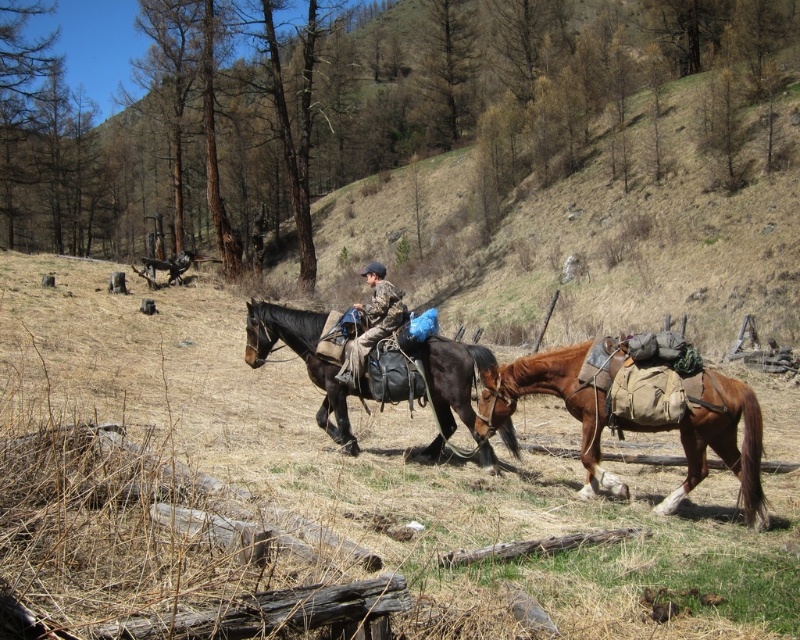
You are a traveler planning to ride the brown leather horse at right and carry the brown leather saddle at center. Given their sizes, will the saddle fit comfortably on the horse?

The brown leather horse at right occupies less space than the brown leather saddle at center, so the saddle may not fit comfortably as it is larger than the horse.

You are a hiker who wants to pack your camouflage fabric jacket at center and brown leather saddle at center into a backpack. Which item should you place first into the backpack to ensure the taller item is at the bottom?

The brown leather saddle at center is taller than the camouflage fabric jacket at center, so you should place the brown leather saddle at center first at the bottom of the backpack.

You are a hiker who wants to take a photo of the brown leather horse at right and the camouflage fabric jacket at center. Which object will appear larger in your camera viewfinder?

The brown leather horse at right will appear larger in the camera viewfinder because it is taller than the camouflage fabric jacket at center.